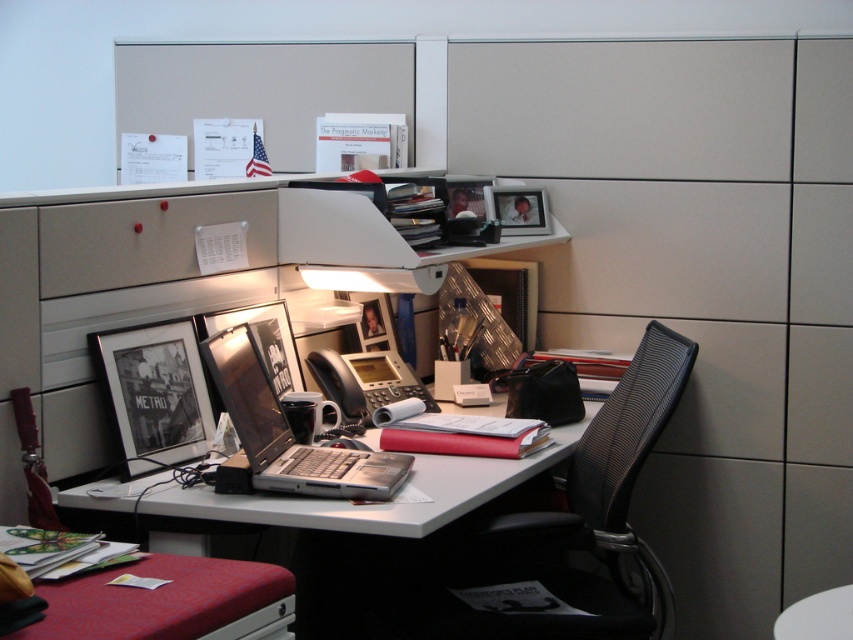
How distant is black mesh swivel chair at right from metallic silver laptop at center?

The distance of black mesh swivel chair at right from metallic silver laptop at center is 11.75 inches.

The width and height of the screenshot is (853, 640). What do you see at coordinates (579, 522) in the screenshot?
I see `black mesh swivel chair at right` at bounding box center [579, 522].

Is point (682, 387) in front of point (320, 500)?

No, (682, 387) is further to viewer.

Image resolution: width=853 pixels, height=640 pixels. I want to click on black mesh swivel chair at right, so click(x=579, y=522).

Does metallic silver laptop at center have a larger size compared to metallic silver drawer at lower center?

Yes, metallic silver laptop at center is bigger than metallic silver drawer at lower center.

This screenshot has width=853, height=640. What do you see at coordinates (372, 529) in the screenshot?
I see `metallic silver laptop at center` at bounding box center [372, 529].

Is point (561, 452) positioned before point (270, 620)?

No, (561, 452) is further to viewer.

Find the location of `metallic silver laptop at center`. metallic silver laptop at center is located at coordinates (372, 529).

Which is more to the left, black mesh swivel chair at right or silver metallic laptop at center?

silver metallic laptop at center

Does black mesh swivel chair at right come behind silver metallic laptop at center?

Yes, black mesh swivel chair at right is further from the viewer.

Which is in front, point (677, 339) or point (355, 468)?

Point (355, 468)

Find the location of a particular element. This screenshot has width=853, height=640. black mesh swivel chair at right is located at coordinates (579, 522).